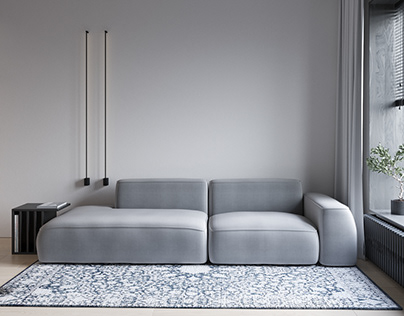
Where is `couch arm`? couch arm is located at coordinates (334, 220).